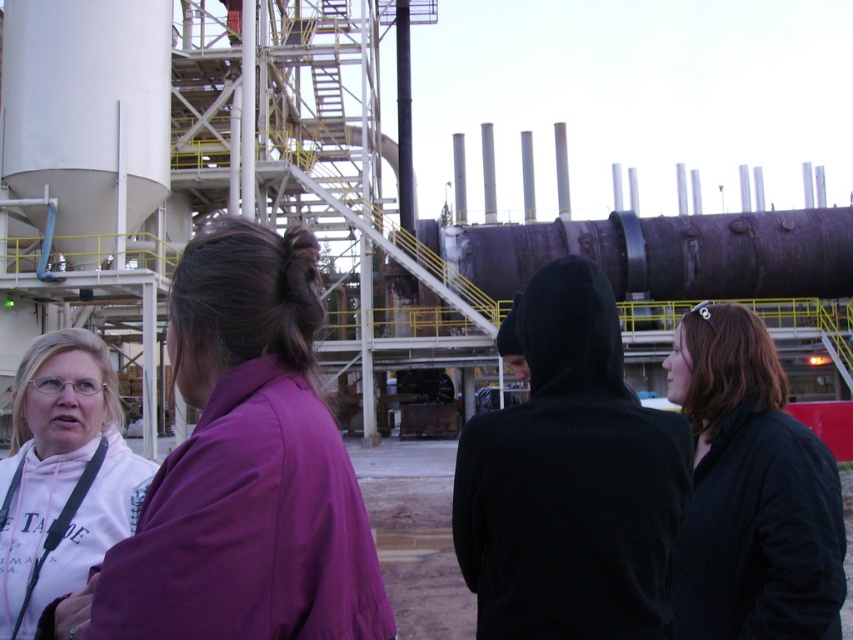
Is purple fabric shirt at left smaller than black matte jacket at lower right?

Actually, purple fabric shirt at left might be larger than black matte jacket at lower right.

Based on the photo, between purple fabric shirt at left and black matte jacket at lower right, which one appears on the left side from the viewer's perspective?

From the viewer's perspective, purple fabric shirt at left appears more on the left side.

Between point (264, 237) and point (700, 433), which one is positioned in front?

Point (264, 237) is more forward.

You are a GUI agent. You are given a task and a screenshot of the screen. Output one action in this format:
    pyautogui.click(x=<x>, y=<y>)
    Task: Click on the purple fabric shirt at left
    The height and width of the screenshot is (640, 853).
    Given the screenshot: What is the action you would take?
    pyautogui.click(x=247, y=467)

Is black matte jacket at lower right to the left of white cotton hoodie at lower left from the viewer's perspective?

Incorrect, black matte jacket at lower right is not on the left side of white cotton hoodie at lower left.

Is point (715, 440) more distant than point (22, 595)?

Yes, it is.

Identify the location of black matte jacket at lower right. The width and height of the screenshot is (853, 640). (750, 492).

Which is more to the right, purple fabric shirt at left or white cotton hoodie at lower left?

purple fabric shirt at left is more to the right.

Between point (207, 324) and point (15, 572), which one is positioned in front?

Point (207, 324) is more forward.

The image size is (853, 640). Find the location of `purple fabric shirt at left`. purple fabric shirt at left is located at coordinates (247, 467).